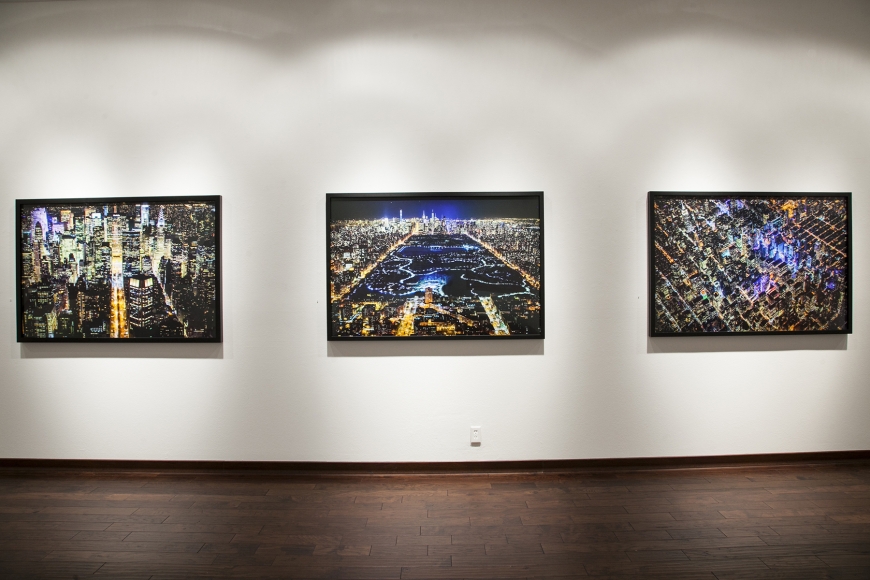
Identify the location of painting. (165, 286), (479, 292), (707, 284).